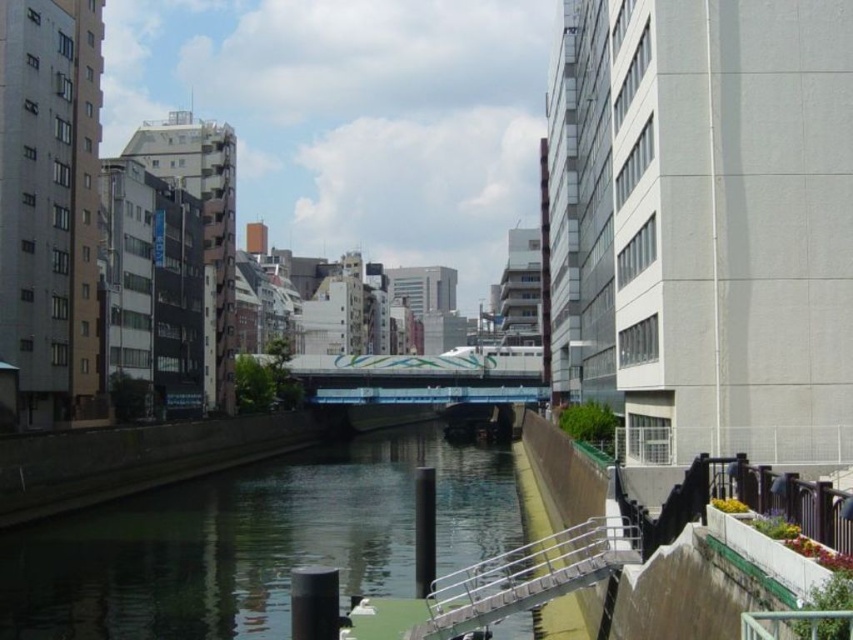
Question: Is green smooth water at center wider than silver metallic railing at lower center?

Choices:
 (A) yes
 (B) no

Answer: (A)

Question: Which point appears closest to the camera in this image?

Choices:
 (A) (450, 636)
 (B) (358, 461)

Answer: (A)

Question: Does green smooth water at center lie in front of silver metallic railing at lower center?

Choices:
 (A) no
 (B) yes

Answer: (A)

Question: Which point is farther to the camera?

Choices:
 (A) (241, 625)
 (B) (596, 538)

Answer: (A)

Question: Which of the following is the closest to the observer?

Choices:
 (A) silver metallic railing at lower center
 (B) green smooth water at center

Answer: (A)

Question: Can you confirm if green smooth water at center is positioned to the right of silver metallic railing at lower center?

Choices:
 (A) no
 (B) yes

Answer: (A)